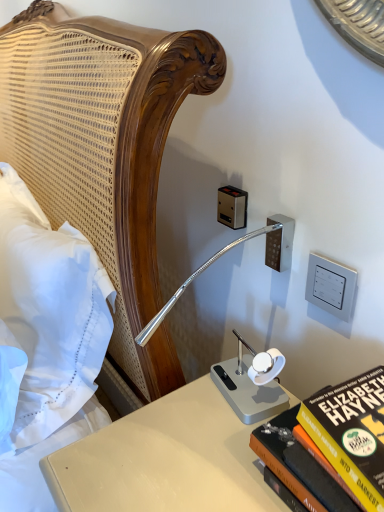
Question: Considering their positions, is white plastic switch at upper right, positioned as the second electric outlet in left-to-right order, located in front of or behind white cotton pillow at left?

Choices:
 (A) behind
 (B) front

Answer: (A)

Question: Would you say white plastic switch at upper right, which ranks as the 2th electric outlet in back-to-front order, is to the left or to the right of white cotton pillow at left in the picture?

Choices:
 (A) right
 (B) left

Answer: (A)

Question: Which object is positioned closest to the metallic silver outlet at upper center, acting as the first electric outlet starting from the left?

Choices:
 (A) white plastic switch at upper right, positioned as the second electric outlet in left-to-right order
 (B) hardcover book at lower right
 (C) white cotton pillow at left

Answer: (A)

Question: Which of these objects is positioned closest to the white cotton pillow at left?

Choices:
 (A) white plastic switch at upper right, which ranks as the first electric outlet in bottom-to-top order
 (B) hardcover book at lower right
 (C) metallic silver outlet at upper center, arranged as the first electric outlet when viewed from the top

Answer: (C)